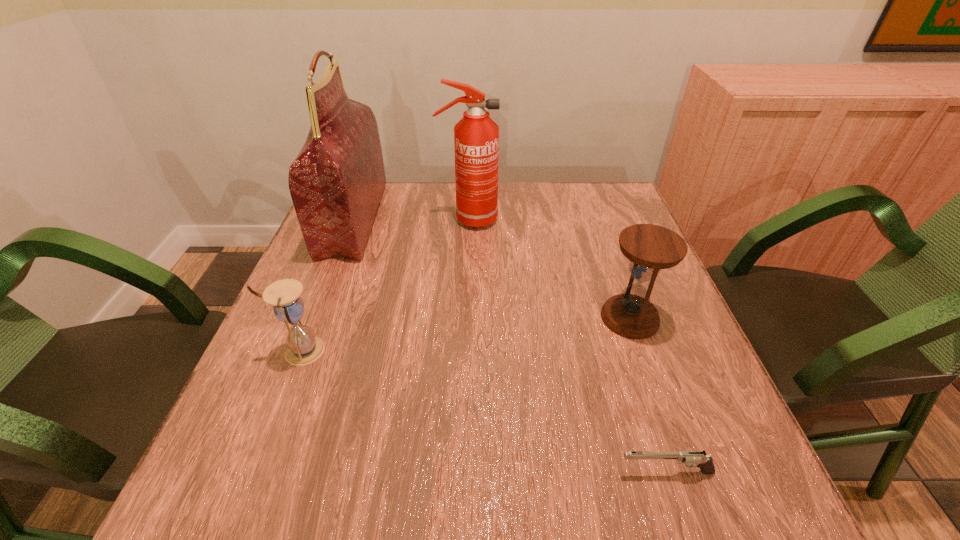
Identify the location of handbag. The width and height of the screenshot is (960, 540). pyautogui.click(x=336, y=182).

Identify the location of the second tallest object. The height and width of the screenshot is (540, 960). (476, 136).

The width and height of the screenshot is (960, 540). Identify the location of fire extinguisher. (476, 136).

I want to click on the right hourglass, so click(x=650, y=248).

In order to click on the left hourglass in this screenshot , I will do `click(304, 347)`.

You are a GUI agent. You are given a task and a screenshot of the screen. Output one action in this format:
    pyautogui.click(x=<x>, y=<y>)
    Task: Click on the pistol
    
    Given the screenshot: What is the action you would take?
    pyautogui.click(x=698, y=459)

Image resolution: width=960 pixels, height=540 pixels. I want to click on the nearest object, so click(698, 459).

Where is `vacant point located 0.230m on the front-facing side of the handbag`? The image size is (960, 540). vacant point located 0.230m on the front-facing side of the handbag is located at coordinates (459, 219).

You are a GUI agent. You are given a task and a screenshot of the screen. Output one action in this format:
    pyautogui.click(x=<x>, y=<y>)
    Task: Click on the blank space located at the nozzle of the fire extinguisher
    
    Given the screenshot: What is the action you would take?
    pyautogui.click(x=611, y=220)

I want to click on vacant area situated on the front of the right hourglass, so click(659, 400).